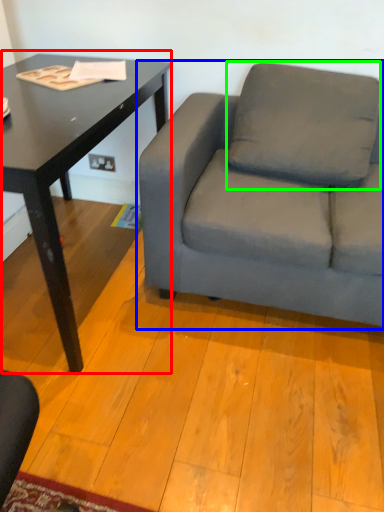
Question: Estimate the real-world distances between objects in this image. Which object is closer to table (highlighted by a red box), studio couch (highlighted by a blue box) or pillow (highlighted by a green box)?

Choices:
 (A) studio couch
 (B) pillow

Answer: (A)